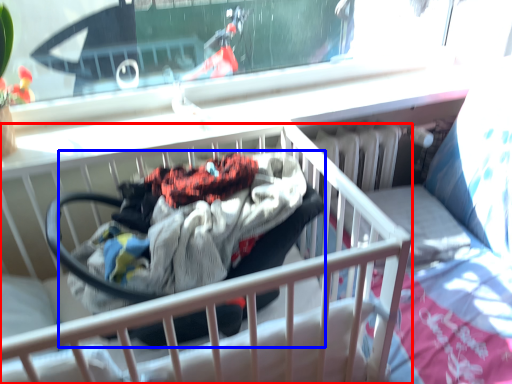
Question: Which point is further to the camera, infant bed (highlighted by a red box) or baby carriage (highlighted by a blue box)?

Choices:
 (A) infant bed
 (B) baby carriage

Answer: (B)